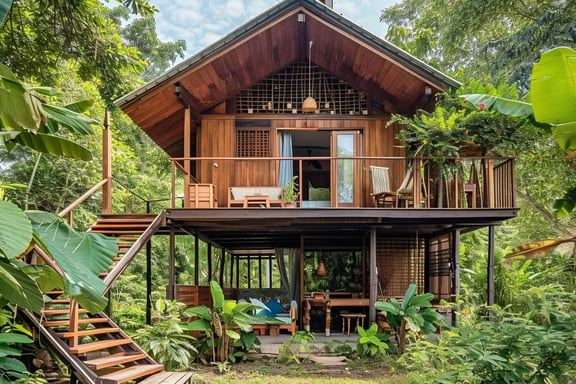
Identify the location of curtain. Image resolution: width=576 pixels, height=384 pixels. (282, 150).